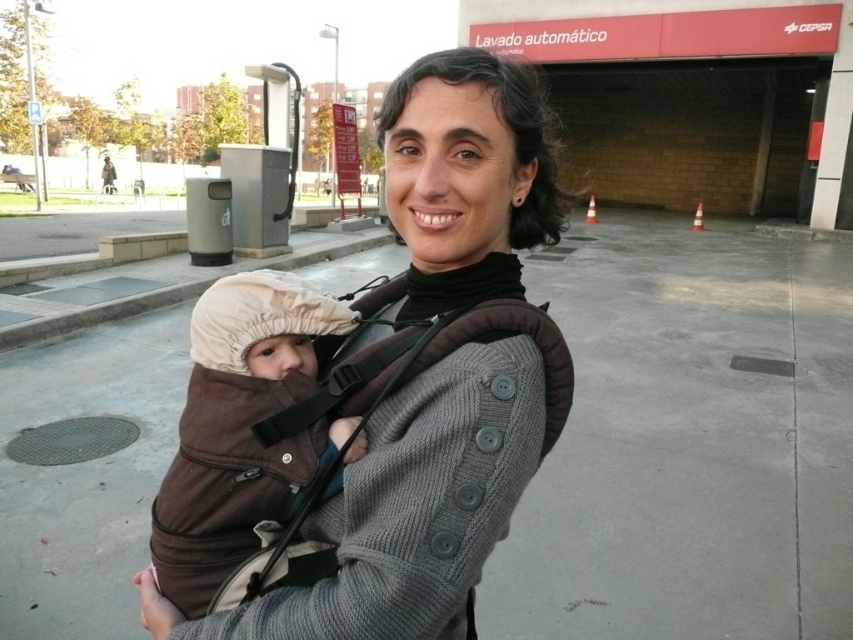
Question: Can you confirm if knit gray sweater at center is thinner than brown fleece baby at center?

Choices:
 (A) no
 (B) yes

Answer: (A)

Question: Which point is farther from the camera taking this photo?

Choices:
 (A) (491, 378)
 (B) (221, 301)

Answer: (B)

Question: Which object appears farthest from the camera in this image?

Choices:
 (A) knit gray sweater at center
 (B) brown fleece baby at center

Answer: (B)

Question: Is knit gray sweater at center smaller than brown fleece baby at center?

Choices:
 (A) no
 (B) yes

Answer: (A)

Question: Which of the following is the farthest from the observer?

Choices:
 (A) knit gray sweater at center
 (B) brown fleece baby at center

Answer: (B)

Question: Is knit gray sweater at center to the left of brown fleece baby at center from the viewer's perspective?

Choices:
 (A) yes
 (B) no

Answer: (B)